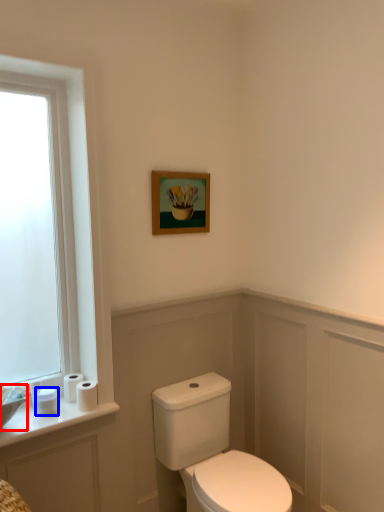
Question: Which point is further to the camera, sink (highlighted by a red box) or toilet paper (highlighted by a blue box)?

Choices:
 (A) sink
 (B) toilet paper

Answer: (B)